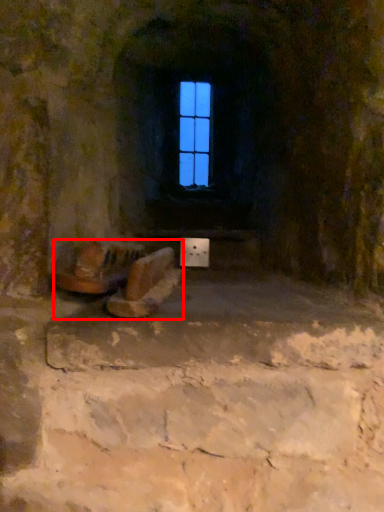
Question: From the image's perspective, where is furniture (annotated by the red box) located relative to window?

Choices:
 (A) above
 (B) below

Answer: (B)